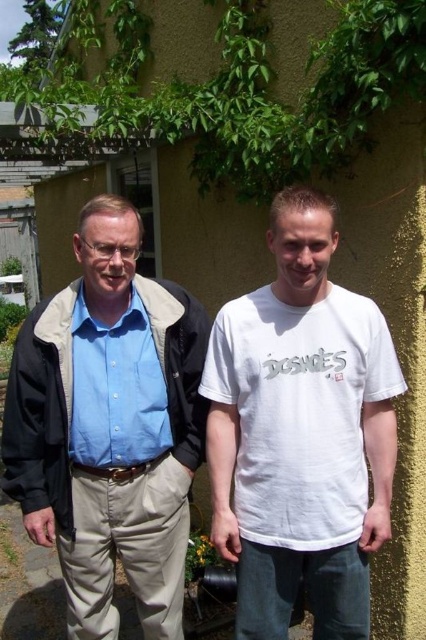
Is blue cotton shirt at center closer to camera compared to matte blue shirt at left?

Yes, it is in front of matte blue shirt at left.

Who is higher up, blue cotton shirt at center or matte blue shirt at left?

matte blue shirt at left is higher up.

Consider the image. Who is more forward, (x=196, y=424) or (x=101, y=394)?

Point (x=101, y=394) is more forward.

Locate an element on the screen. The height and width of the screenshot is (640, 426). blue cotton shirt at center is located at coordinates (109, 428).

Does white cotton t-shirt at center have a greater height compared to green leafy ivy at upper center?

No.

Which is below, white cotton t-shirt at center or green leafy ivy at upper center?

Positioned lower is white cotton t-shirt at center.

Which is behind, point (258, 324) or point (198, 134)?

The point (198, 134) is more distant.

Find the location of a particular element. This screenshot has height=640, width=426. white cotton t-shirt at center is located at coordinates (301, 433).

Who is positioned more to the right, blue cotton shirt at center or green leafy ivy at upper center?

Positioned to the right is blue cotton shirt at center.

Is blue cotton shirt at center bigger than green leafy ivy at upper center?

No, blue cotton shirt at center is not bigger than green leafy ivy at upper center.

What are the coordinates of `blue cotton shirt at center` in the screenshot? It's located at (109, 428).